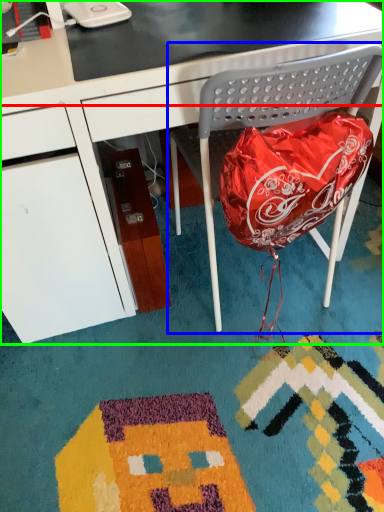
Question: Which is nearer to the table top (highlighted by a red box)? folding chair (highlighted by a blue box) or desk (highlighted by a green box).

Choices:
 (A) folding chair
 (B) desk

Answer: (B)